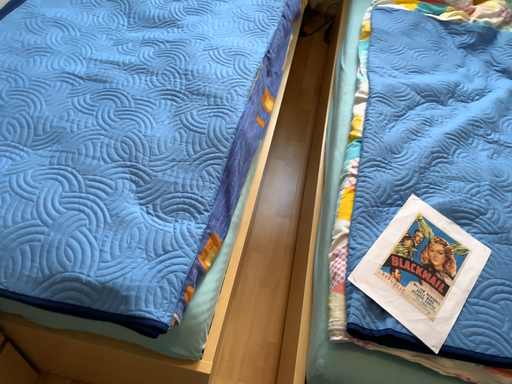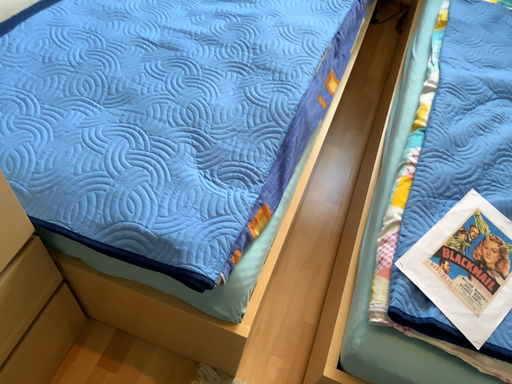
Question: Which way did the camera rotate in the video?

Choices:
 (A) rotated right
 (B) rotated left

Answer: (B)